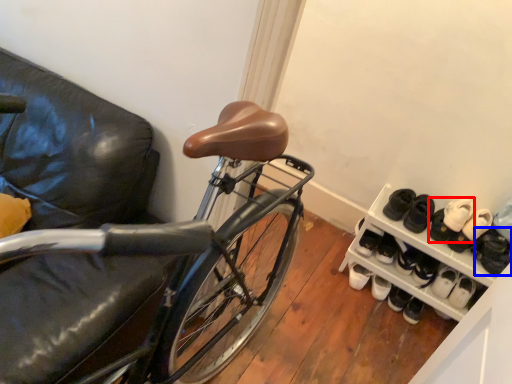
Question: Which object appears closest to the camera in this image, footwear (highlighted by a red box) or footwear (highlighted by a blue box)?

Choices:
 (A) footwear
 (B) footwear

Answer: (B)